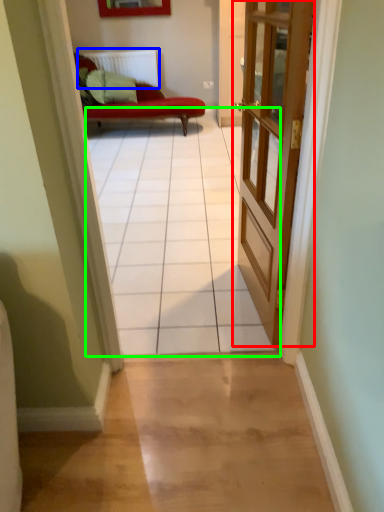
Question: Which object is the farthest from door (highlighted by a red box)? Choose among these: radiator (highlighted by a blue box) or path (highlighted by a green box).

Choices:
 (A) radiator
 (B) path

Answer: (A)